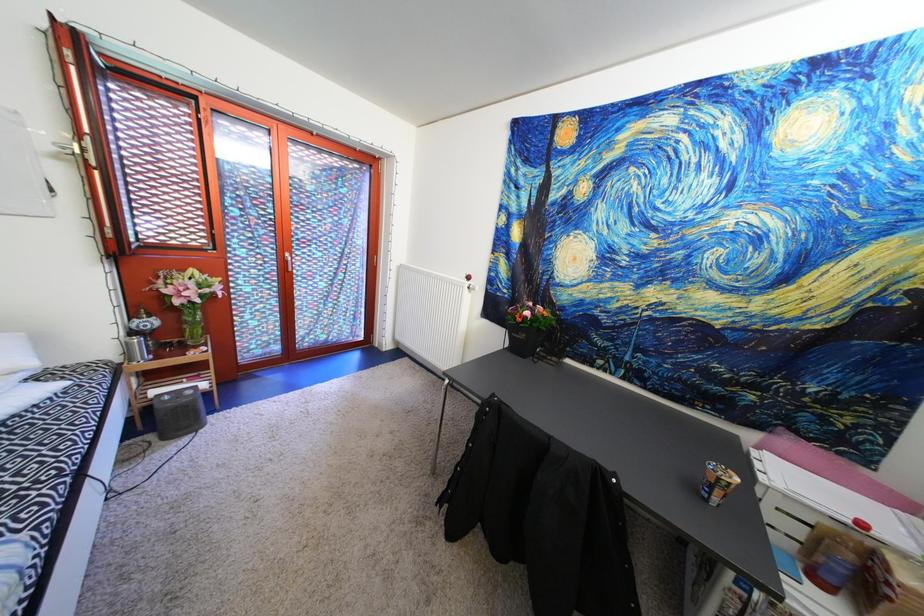
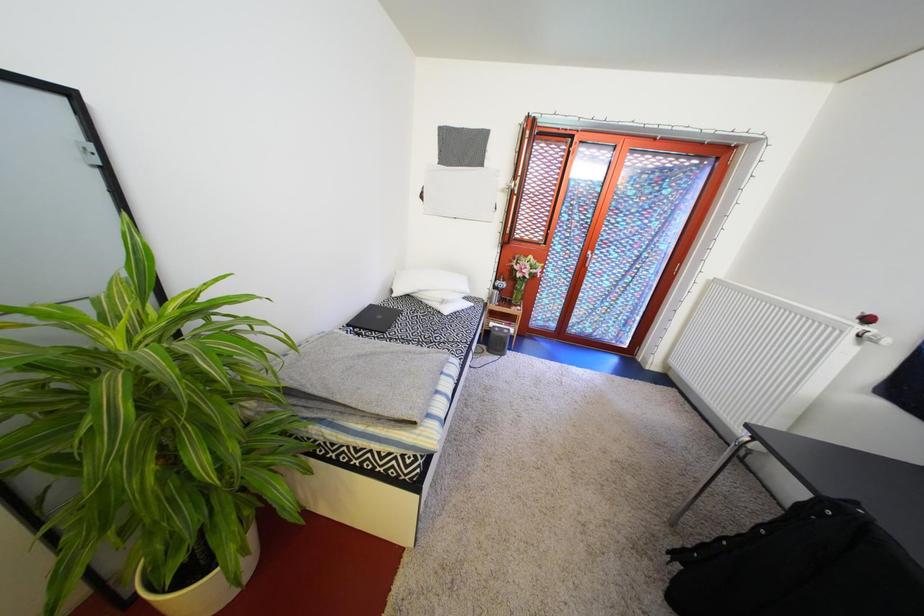
Question: The camera is either moving clockwise (left) or counter-clockwise (right) around the object. The first image is from the beginning of the video and the second image is from the end. Is the camera moving left or right when shooting the video?

Choices:
 (A) Left
 (B) Right

Answer: (B)